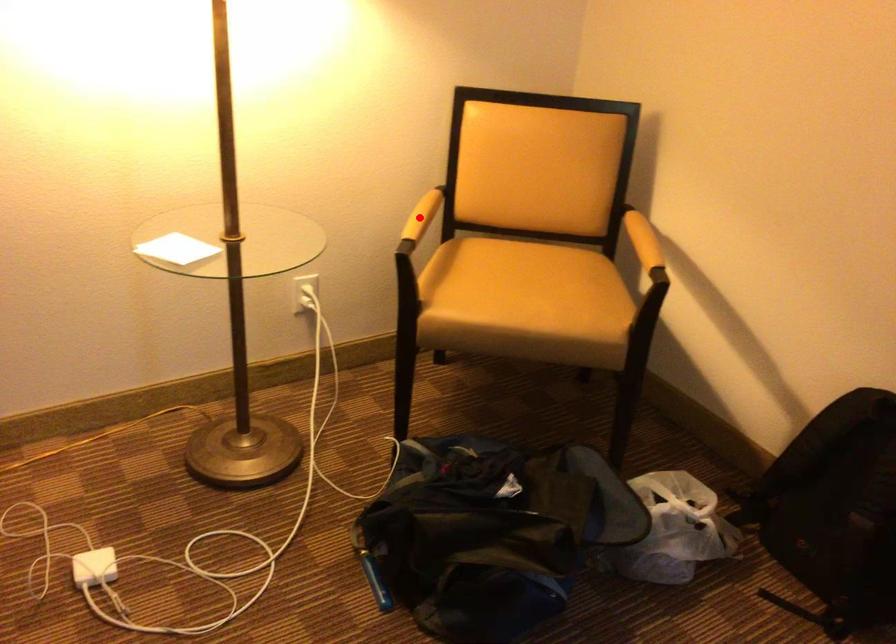
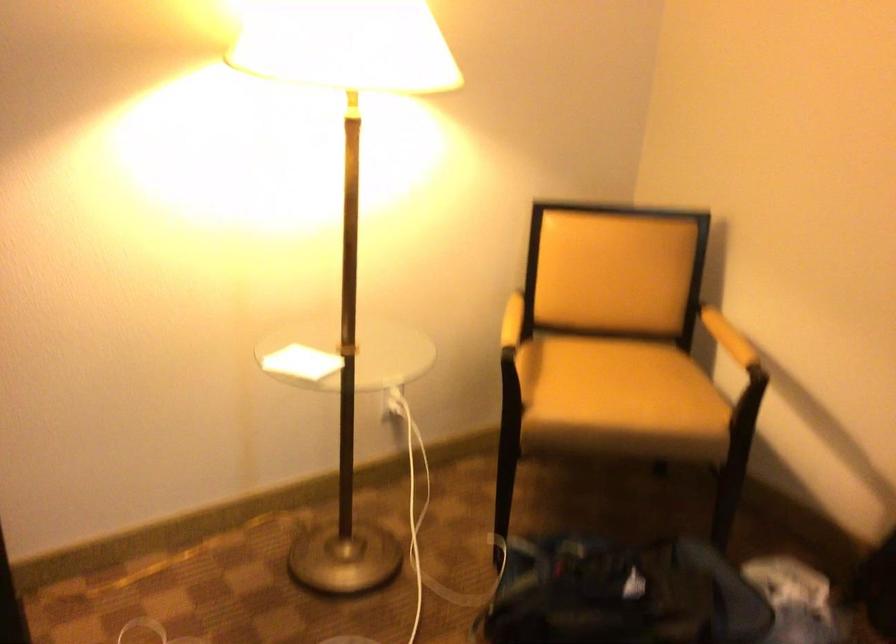
In the second image, find the point that corresponds to the highlighted location in the first image.

(512, 321)